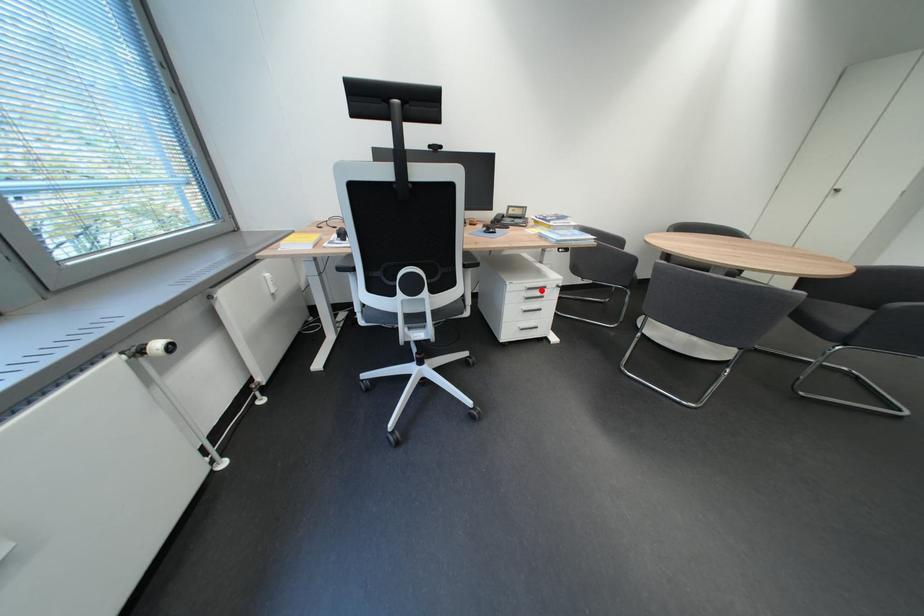
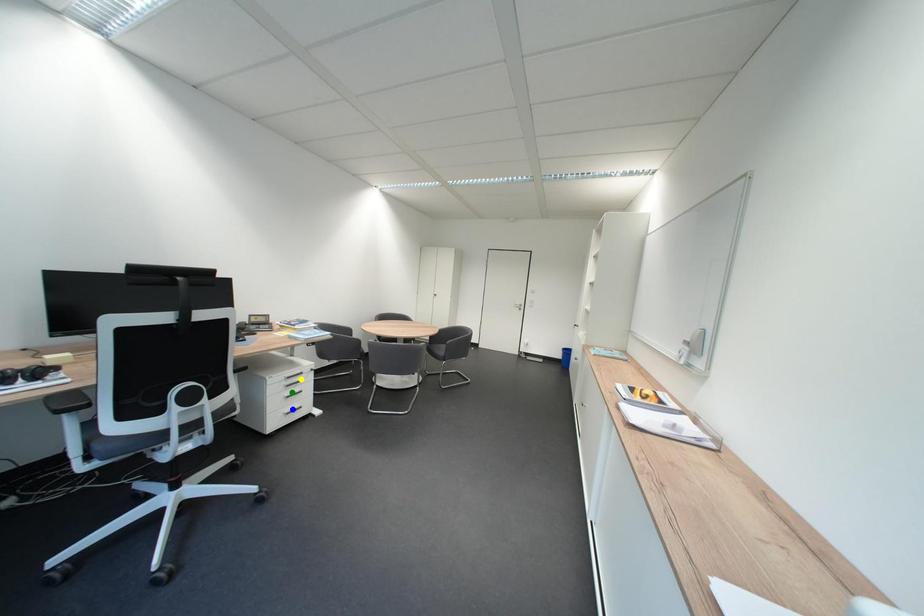
Question: I am providing you with two images of the same scene from different viewpoints. A red point is marked on the first image. You are given multiple points on the second image. Which point in image 2 represents the same 3d spot as the red point in image 1?

Choices:
 (A) green point
 (B) yellow point
 (C) blue point

Answer: (B)